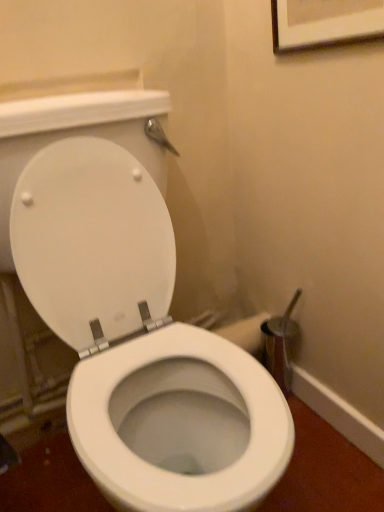
Question: Considering the positions of white glossy toilet at center and wooden framed picture at upper center in the image, is white glossy toilet at center bigger or smaller than wooden framed picture at upper center?

Choices:
 (A) small
 (B) big

Answer: (B)

Question: Is white glossy toilet at center inside or outside of wooden framed picture at upper center?

Choices:
 (A) inside
 (B) outside

Answer: (B)

Question: In the image, is white glossy toilet at center positioned in front of or behind wooden framed picture at upper center?

Choices:
 (A) front
 (B) behind

Answer: (A)

Question: Based on their sizes in the image, would you say wooden framed picture at upper center is bigger or smaller than white glossy toilet at center?

Choices:
 (A) big
 (B) small

Answer: (B)

Question: In the image, is wooden framed picture at upper center positioned in front of or behind white glossy toilet at center?

Choices:
 (A) behind
 (B) front

Answer: (A)

Question: From a real-world perspective, is wooden framed picture at upper center positioned above or below white glossy toilet at center?

Choices:
 (A) below
 (B) above

Answer: (B)

Question: Is wooden framed picture at upper center wider or thinner than white glossy toilet at center?

Choices:
 (A) thin
 (B) wide

Answer: (A)